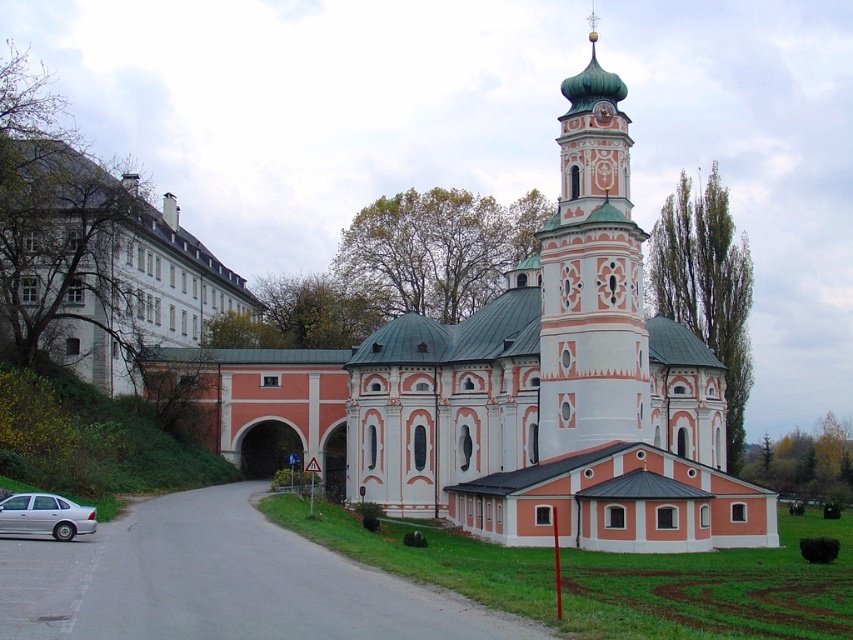
Who is shorter, light blue painted stone tower at center right or silver metallic car at lower left?

silver metallic car at lower left

Is light blue painted stone tower at center right bigger than silver metallic car at lower left?

Correct, light blue painted stone tower at center right is larger in size than silver metallic car at lower left.

Between point (637, 321) and point (4, 524), which one is positioned behind?

Point (637, 321)

Where is `light blue painted stone tower at center right`? light blue painted stone tower at center right is located at coordinates (590, 280).

Can you confirm if white stucco church at center is wider than light blue painted stone tower at center right?

Correct, the width of white stucco church at center exceeds that of light blue painted stone tower at center right.

Does white stucco church at center appear on the left side of light blue painted stone tower at center right?

Indeed, white stucco church at center is positioned on the left side of light blue painted stone tower at center right.

Between point (589, 289) and point (589, 93), which one is positioned in front?

Point (589, 289)

At what (x,y) coordinates should I click in order to perform the action: click on white stucco church at center. Please return your answer as a coordinate pair (x, y). This screenshot has width=853, height=640. Looking at the image, I should click on (527, 387).

Image resolution: width=853 pixels, height=640 pixels. Describe the element at coordinates (527, 387) in the screenshot. I see `white stucco church at center` at that location.

Locate an element on the screen. white stucco church at center is located at coordinates (527, 387).

Identify the location of white stucco church at center. Image resolution: width=853 pixels, height=640 pixels. (527, 387).

The width and height of the screenshot is (853, 640). I want to click on white stucco church at center, so click(x=527, y=387).